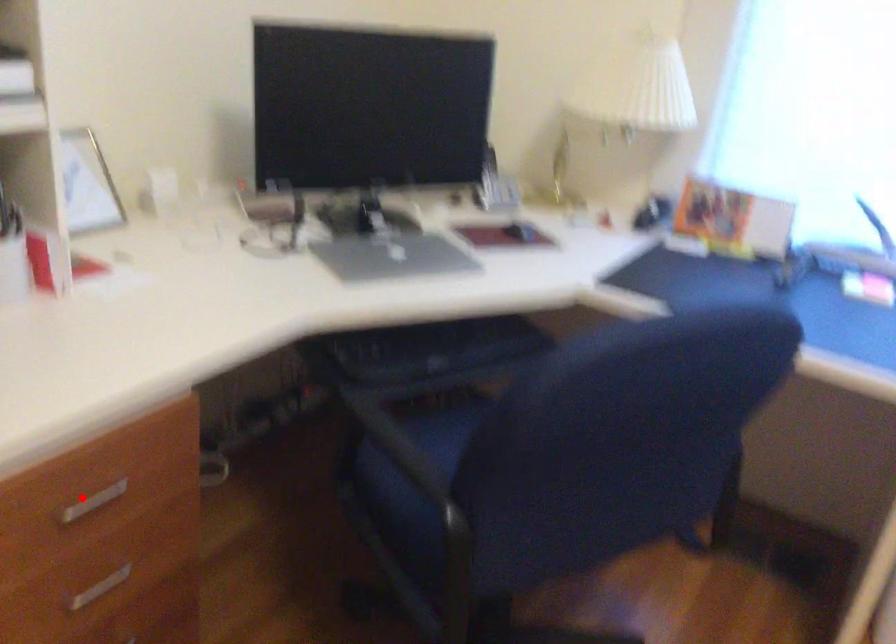
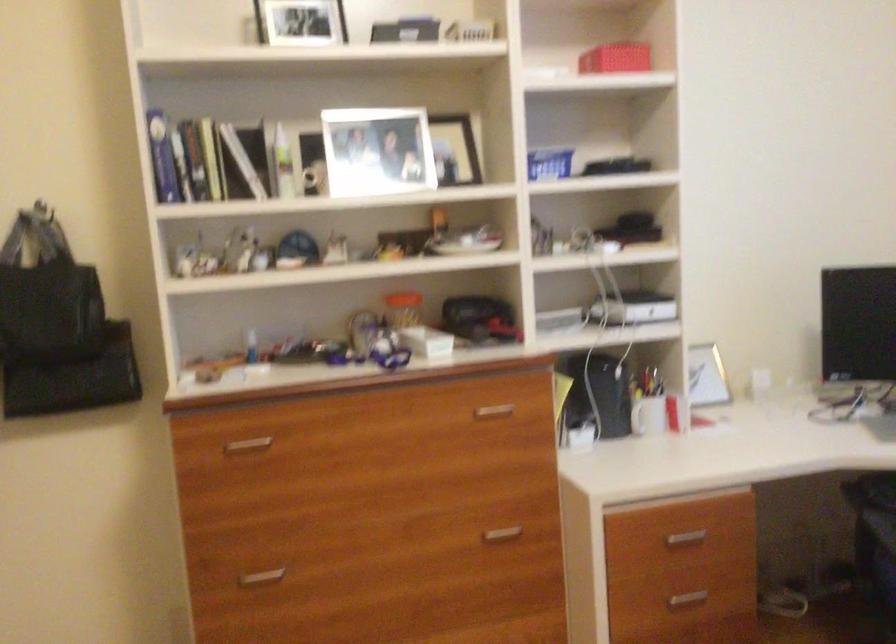
Question: I am providing you with two images of the same scene from different viewpoints. Given a red point in image1, look at the same physical point in image2. Is it:

Choices:
 (A) Closer to the viewpoint
 (B) Farther from the viewpoint

Answer: (B)